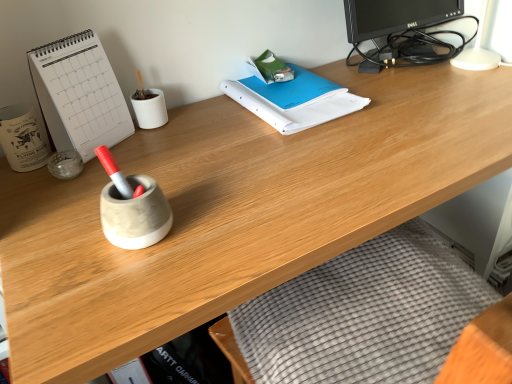
The image size is (512, 384). Find the location of `free space in front of white paper at left`. free space in front of white paper at left is located at coordinates (64, 203).